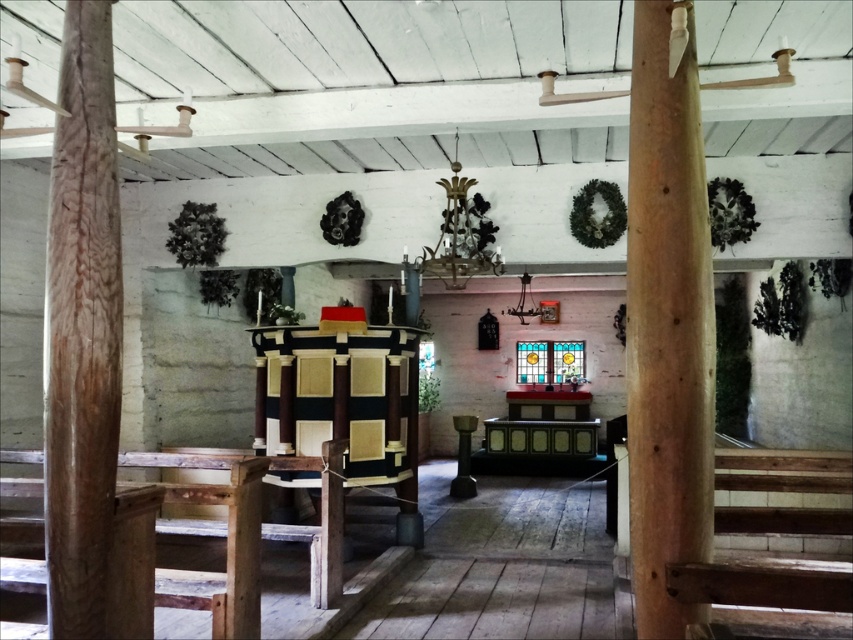
Between smooth light brown wooden pillar at center and brown wood pillar at left, which one appears on the left side from the viewer's perspective?

brown wood pillar at left

Between smooth light brown wooden pillar at center and brown wood pillar at left, which one appears on the right side from the viewer's perspective?

Positioned to the right is smooth light brown wooden pillar at center.

Who is more forward, (x=708, y=291) or (x=64, y=51)?

Point (x=708, y=291) is in front.

Where is `smooth light brown wooden pillar at center`? The height and width of the screenshot is (640, 853). smooth light brown wooden pillar at center is located at coordinates [x=666, y=326].